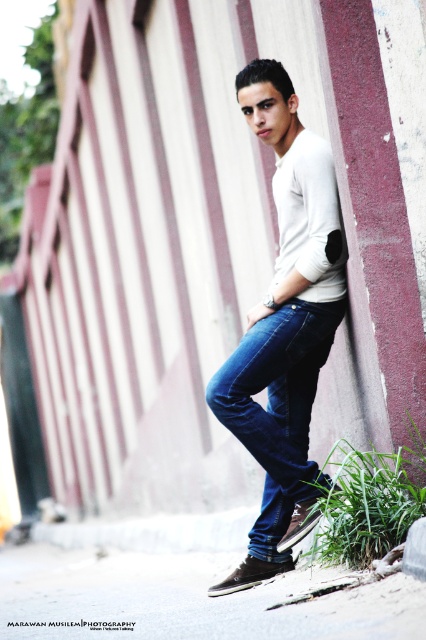
Based on the photo, you are standing in front of the man in the image. You want to place a small sticker on the point that is closer to you. Which point should you choose between point (258, 67) and point (236, 360)?

Point (236, 360) is closer to you than point (258, 67), so you should choose point (236, 360) for placing the sticker.

You are a fashion designer observing a model wearing the matte white sweater at center and dark blue denim jeans at lower center. Which clothing item has a greater horizontal span when viewed from the front?

The matte white sweater at center has a greater horizontal span than the dark blue denim jeans at lower center because its width is larger.

You are a fashion designer observing the image. You want to know if the matte white sweater at center is visible over the dark blue denim jeans at lower center. Can you confirm this?

The matte white sweater at center is in front of dark blue denim jeans at lower center, so yes, the sweater is visible over the jeans.